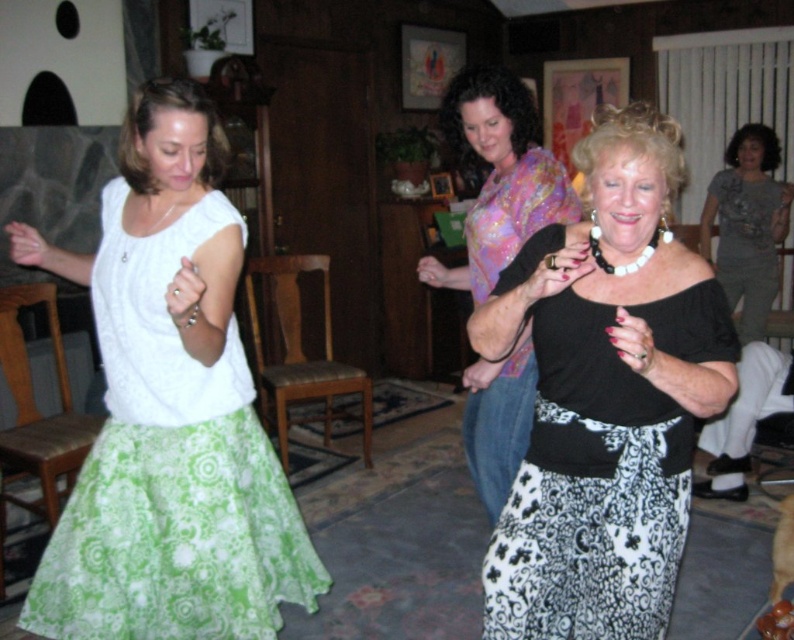
Can you confirm if floral silk blouse at center is positioned to the right of gray matte shirt at upper right?

In fact, floral silk blouse at center is to the left of gray matte shirt at upper right.

In order to click on floral silk blouse at center in this screenshot , I will do `click(498, 177)`.

Who is lower down, black matte skirt at center or gray matte shirt at upper right?

Positioned lower is black matte skirt at center.

Between point (500, 577) and point (764, 163), which one is positioned behind?

Point (764, 163)

Is point (634, 196) closer to camera compared to point (739, 152)?

Yes.

Image resolution: width=794 pixels, height=640 pixels. What are the coordinates of `black matte skirt at center` in the screenshot? It's located at (604, 397).

Who is more forward, [675,317] or [538,211]?

Point [675,317]

Can you confirm if black matte skirt at center is positioned below floral silk blouse at center?

Indeed, black matte skirt at center is positioned under floral silk blouse at center.

The width and height of the screenshot is (794, 640). Identify the location of black matte skirt at center. (604, 397).